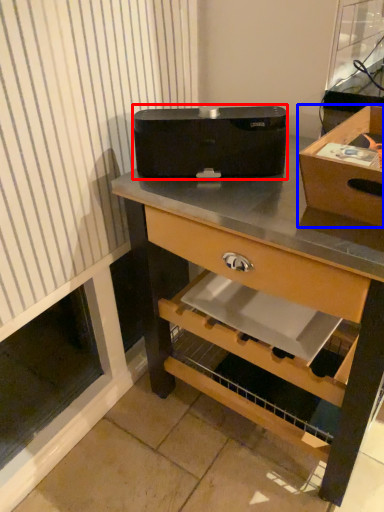
Question: Which of the following is the closest to the observer, appliance (highlighted by a red box) or box (highlighted by a blue box)?

Choices:
 (A) appliance
 (B) box

Answer: (B)